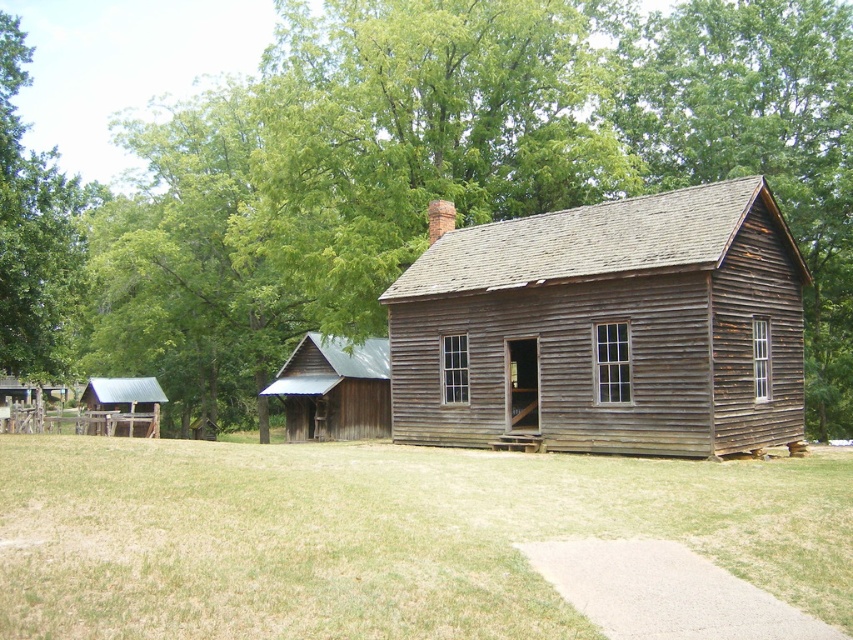
Question: Observing the image, what is the correct spatial positioning of green grass at lower center in reference to rustic wood barn at left?

Choices:
 (A) left
 (B) right

Answer: (B)

Question: Based on their relative distances, which object is farther from the green leafy tree at upper center?

Choices:
 (A) weathered wood log cabin at center
 (B) green grass at lower center
 (C) rustic wood shed at center-left

Answer: (B)

Question: Can you confirm if green leafy tree at upper left is smaller than rustic wood barn at left?

Choices:
 (A) no
 (B) yes

Answer: (A)

Question: Estimate the real-world distances between objects in this image. Which object is farther from the rustic wood shed at center-left?

Choices:
 (A) green leafy tree at upper center
 (B) green grass at lower center
 (C) green leafy tree at upper left
 (D) rustic wood barn at left

Answer: (B)

Question: Which object is the farthest from the green leafy tree at upper left?

Choices:
 (A) rustic wood shed at center-left
 (B) green leafy tree at upper center

Answer: (B)

Question: Does weathered wood log cabin at center appear under rustic wood barn at left?

Choices:
 (A) yes
 (B) no

Answer: (B)